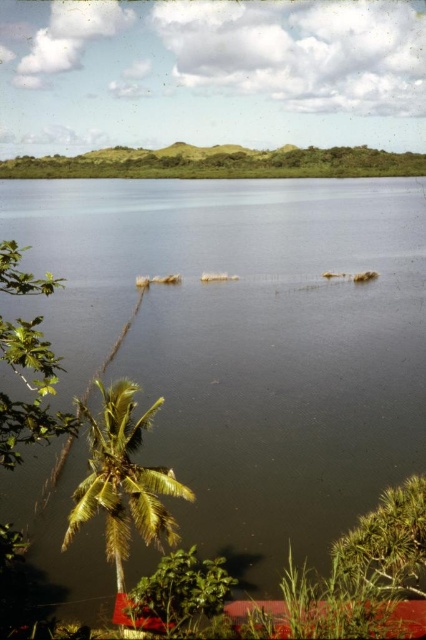
You are standing in the tropical landscape and want to walk towards the green leafy palm tree at lower left and the green leafy tree at lower left. Which one will you reach first?

You will reach the green leafy palm tree at lower left first because it is closer to you than the green leafy tree at lower left, which is further away.